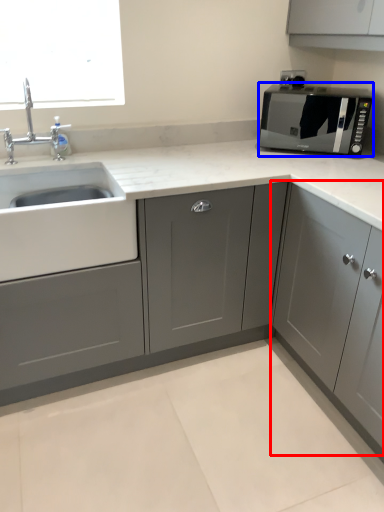
Question: Among these objects, which one is farthest to the camera, cabinetry (highlighted by a red box) or microwave oven (highlighted by a blue box)?

Choices:
 (A) cabinetry
 (B) microwave oven

Answer: (B)